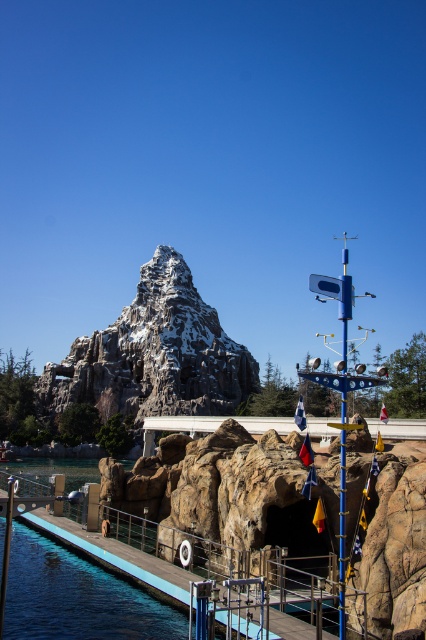
In order to click on rockymaterial/texturecave at center in this screenshot , I will do click(229, 490).

Does rockymaterial/texturecave at center have a lesser height compared to snowy rocky mountain at center?

Yes.

Does point (226, 468) come closer to viewer compared to point (193, 404)?

Yes.

Identify the location of rockymaterial/texturecave at center. (229, 490).